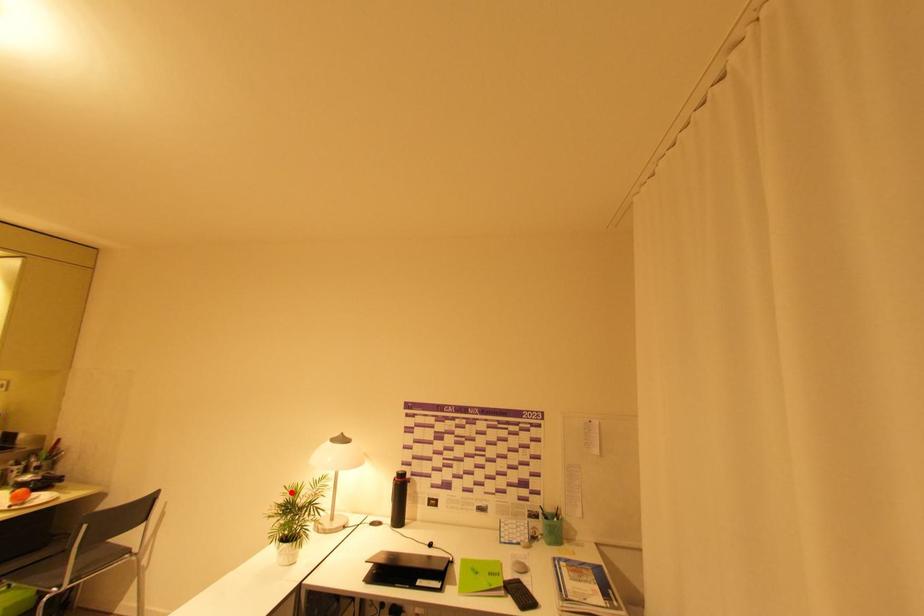
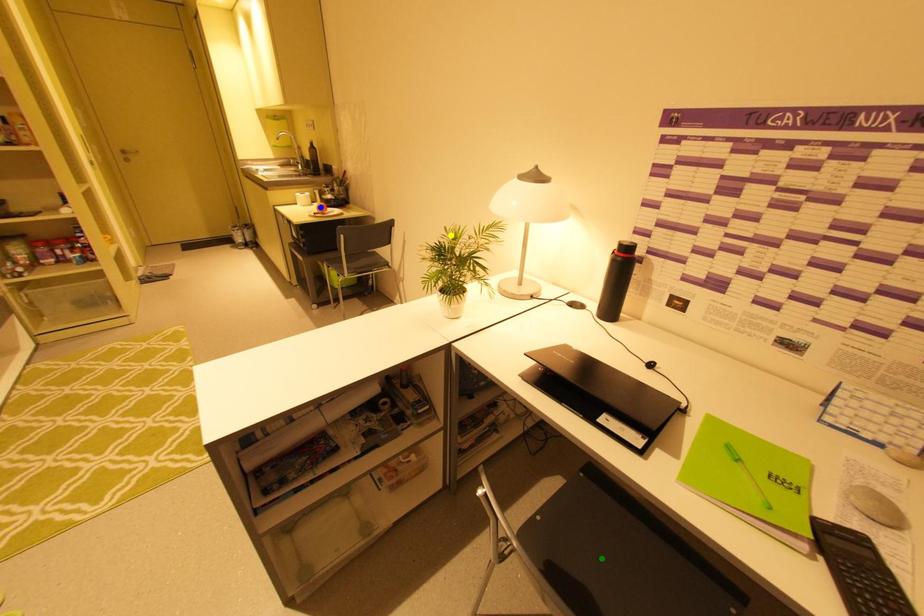
Question: I am providing you with two images of the same scene from different viewpoints. A red point is marked on the first image. You are given multiple points on the second image. In image 2, which mark is for the same physical point as the one in image 1?

Choices:
 (A) yellow point
 (B) blue point
 (C) green point

Answer: (A)